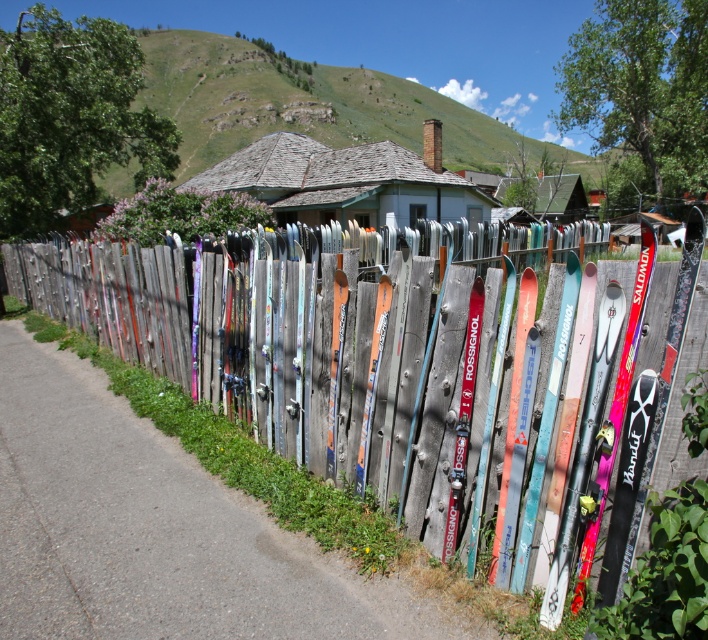
You are a visitor standing in front of the rustic wooden fence. You notice the wooden skis at center and the gray shingled house at center. Which object is positioned lower in the image?

The wooden skis at center are positioned lower than the gray shingled house at center because the description states that the wooden skis at center is located below the gray shingled house at center.

You are a visitor standing in front of the rustic wooden fence. You see the wooden skis at center and the gray shingled house at center. Which object is shorter in height?

The wooden skis at center are shorter than the gray shingled house at center.